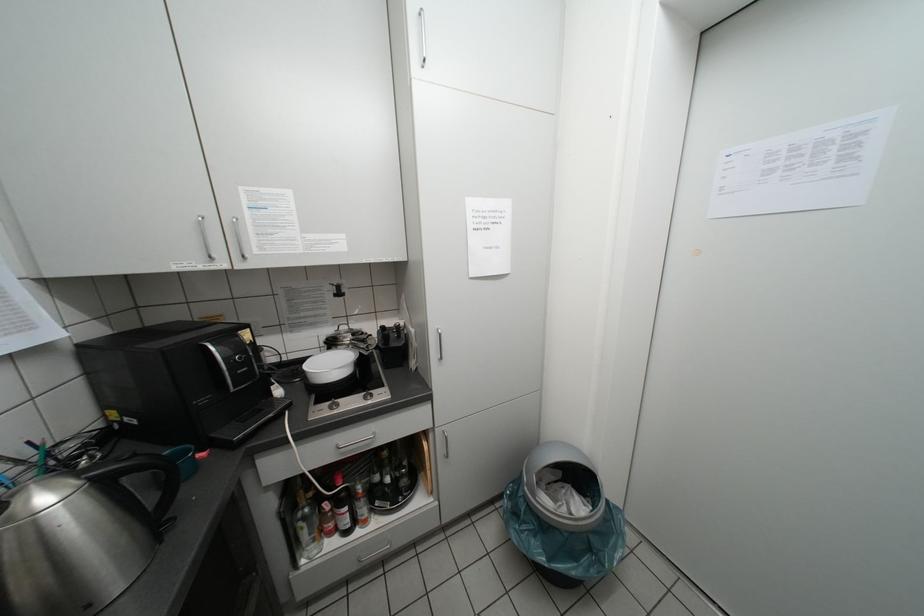
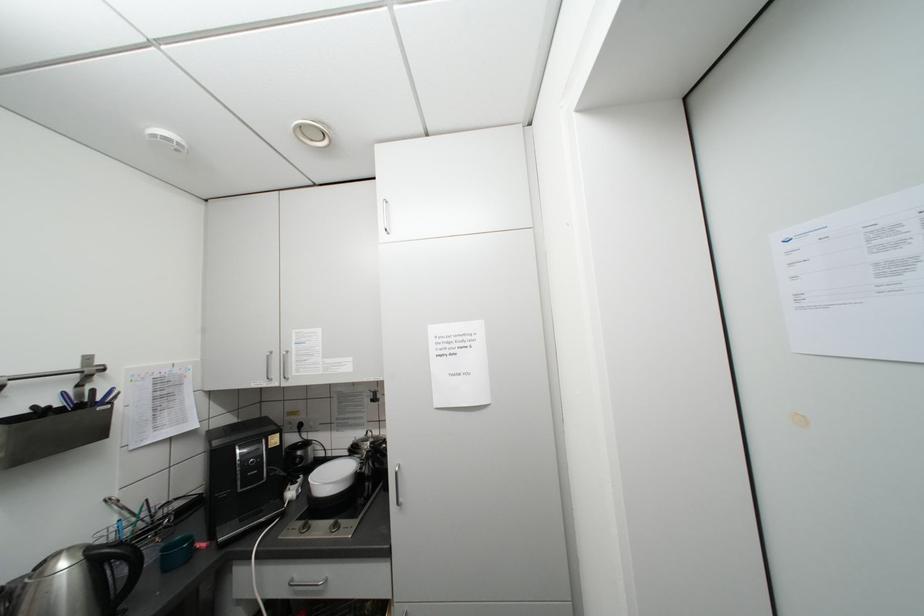
How did the camera likely rotate?

The rotation direction of the camera is left-up.